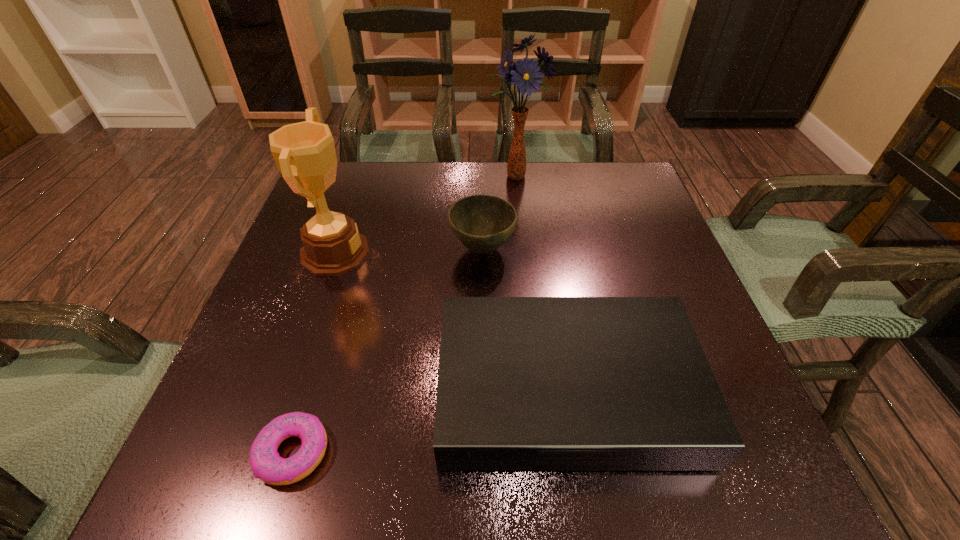
This screenshot has width=960, height=540. In order to click on free point at the left edge in this screenshot , I will do `click(281, 382)`.

Image resolution: width=960 pixels, height=540 pixels. I want to click on free space at the right edge, so click(606, 226).

This screenshot has width=960, height=540. In order to click on vacant space at the far left corner in this screenshot , I will do `click(347, 166)`.

Identify the location of vacant space at the far right corner. (648, 204).

The image size is (960, 540). I want to click on vacant space at the near right corner of the desktop, so click(x=734, y=476).

Where is `free space between the award and the flower arrangement`? This screenshot has width=960, height=540. free space between the award and the flower arrangement is located at coordinates (425, 215).

Where is `blank region between the doughnut and the CD player`? The image size is (960, 540). blank region between the doughnut and the CD player is located at coordinates (430, 421).

The width and height of the screenshot is (960, 540). I want to click on unoccupied position between the flower arrangement and the shortest object, so click(404, 314).

Locate an element on the screen. The height and width of the screenshot is (540, 960). vacant space that's between the flower arrangement and the shortest object is located at coordinates (404, 314).

Image resolution: width=960 pixels, height=540 pixels. Find the location of `free space between the fourth shortest object and the flower arrangement`. free space between the fourth shortest object and the flower arrangement is located at coordinates (425, 215).